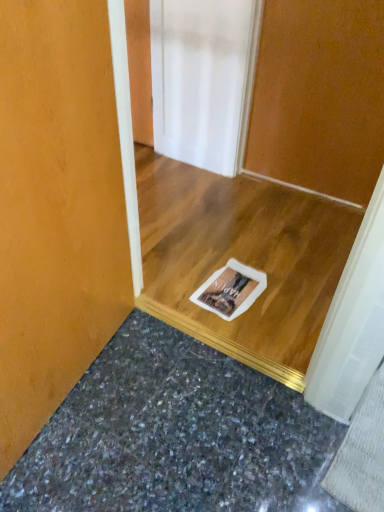
The height and width of the screenshot is (512, 384). What do you see at coordinates (175, 436) in the screenshot? I see `granite at lower center` at bounding box center [175, 436].

Where is `granite at lower center`? Image resolution: width=384 pixels, height=512 pixels. granite at lower center is located at coordinates (175, 436).

Describe the element at coordinates (319, 96) in the screenshot. The image size is (384, 512). I see `wooden door at center` at that location.

The width and height of the screenshot is (384, 512). I want to click on wooden door at center, so click(x=319, y=96).

What are the coordinates of `granite at lower center` in the screenshot? It's located at (175, 436).

Is granite at lower center to the left of wooden door at center from the viewer's perspective?

Indeed, granite at lower center is positioned on the left side of wooden door at center.

Does granite at lower center lie behind wooden door at center?

That is False.

Is point (183, 456) positioned after point (271, 57)?

No, (183, 456) is closer to viewer.

Consider the image. From the image's perspective, is granite at lower center under wooden door at center?

Correct, granite at lower center appears lower than wooden door at center in the image.

From a real-world perspective, between granite at lower center and wooden door at center, who is vertically higher?

wooden door at center, from a real-world perspective.

Is granite at lower center wider or thinner than wooden door at center?

Considering their sizes, granite at lower center looks broader than wooden door at center.

Is granite at lower center shorter than wooden door at center?

Yes.

Can you confirm if granite at lower center is smaller than wooden door at center?

Yes, granite at lower center is smaller than wooden door at center.

Is wooden door at center surrounded by granite at lower center?

No, granite at lower center does not contain wooden door at center.

Is granite at lower center not near wooden door at center?

Yes, granite at lower center and wooden door at center are quite far apart.

Is granite at lower center aimed at wooden door at center?

No, granite at lower center does not turn towards wooden door at center.

How different are the orientations of granite at lower center and wooden door at center in degrees?

They differ by 180 degrees in their facing directions.

Measure the distance from granite at lower center to wooden door at center.

A distance of 4.40 feet exists between granite at lower center and wooden door at center.

This screenshot has width=384, height=512. I want to click on door on the right of granite at lower center, so 319,96.

Consider the image. Would you say wooden door at center is to the left or to the right of granite at lower center in the picture?

Clearly, wooden door at center is on the right of granite at lower center in the image.

Is wooden door at center closer to the viewer compared to granite at lower center?

No, wooden door at center is further to the viewer.

Is point (303, 45) positioned after point (280, 496)?

Yes, point (303, 45) is farther from viewer.

From the image's perspective, between wooden door at center and granite at lower center, who is located below?

granite at lower center, from the image's perspective.

From a real-world perspective, is wooden door at center on top of granite at lower center?

Yes.

Which of these two, wooden door at center or granite at lower center, is thinner?

Thinner between the two is wooden door at center.

Can you confirm if wooden door at center is taller than granite at lower center?

Indeed, wooden door at center has a greater height compared to granite at lower center.

Can you confirm if wooden door at center is smaller than granite at lower center?

No.

Would you say wooden door at center is inside or outside granite at lower center?

wooden door at center exists outside the volume of granite at lower center.

Would you say wooden door at center is a long distance from granite at lower center?

wooden door at center is positioned a significant distance from granite at lower center.

Is wooden door at center positioned with its back to granite at lower center?

wooden door at center does not have its back to granite at lower center.

At what (x,y) coordinates should I click in order to perform the action: click on granite in front of the wooden door at center. Please return your answer as a coordinate pair (x, y). This screenshot has width=384, height=512. Looking at the image, I should click on (175, 436).

Locate an element on the screen. The width and height of the screenshot is (384, 512). door that is above the granite at lower center (from a real-world perspective) is located at coordinates (319, 96).

The image size is (384, 512). I want to click on door that is on the right side of granite at lower center, so pos(319,96).